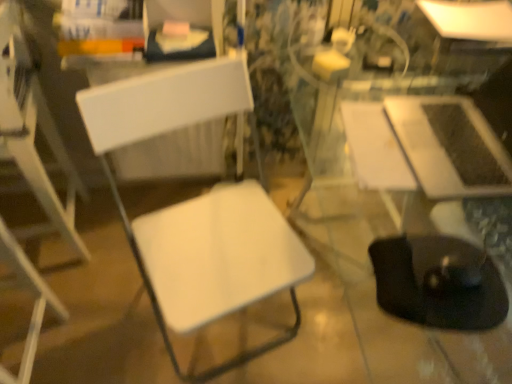
Question: Would you say white plastic chair at left, marked as the second chair in a right-to-left arrangement, is part of white glossy table at upper right, which is the 1th table in top-to-bottom order,'s contents?

Choices:
 (A) no
 (B) yes

Answer: (A)

Question: Can you confirm if white glossy table at upper right, the 2th table positioned from the bottom, is taller than white plastic chair at left, the 1th chair when ordered from left to right?

Choices:
 (A) yes
 (B) no

Answer: (B)

Question: Is white glossy table at upper right, acting as the 1th table starting from the back, with white plastic chair at left, the 1th chair when ordered from left to right?

Choices:
 (A) no
 (B) yes

Answer: (A)

Question: Does white glossy table at upper right, acting as the 1th table starting from the back, appear on the left side of white plastic chair at left, the 1th chair when ordered from left to right?

Choices:
 (A) yes
 (B) no

Answer: (B)

Question: Is white glossy table at upper right, which is the 1th table in top-to-bottom order, outside of white plastic chair at left, marked as the second chair in a right-to-left arrangement?

Choices:
 (A) no
 (B) yes

Answer: (B)

Question: Considering the relative sizes of white glossy table at upper right, the 2th table positioned from the bottom, and white plastic chair at left, the 1th chair when ordered from left to right, in the image provided, is white glossy table at upper right, the 2th table positioned from the bottom, bigger than white plastic chair at left, the 1th chair when ordered from left to right,?

Choices:
 (A) no
 (B) yes

Answer: (A)

Question: Is white plastic chair at left, marked as the second chair in a right-to-left arrangement, not near white glossy table at upper right, the 2th table positioned from the bottom?

Choices:
 (A) no
 (B) yes

Answer: (B)

Question: Does white plastic chair at left, the 1th chair when ordered from left to right, have a lesser height compared to white glossy table at upper right, the 2th table positioned from the bottom?

Choices:
 (A) yes
 (B) no

Answer: (B)

Question: Does white plastic chair at left, the 1th chair when ordered from left to right, have a greater height compared to white glossy table at upper right, which is the 1th table in top-to-bottom order?

Choices:
 (A) no
 (B) yes

Answer: (B)

Question: Does white plastic chair at left, marked as the second chair in a right-to-left arrangement, come in front of white glossy table at upper right, marked as the second table in a front-to-back arrangement?

Choices:
 (A) yes
 (B) no

Answer: (A)

Question: Could you tell me if white plastic chair at left, the 1th chair when ordered from left to right, is facing white glossy table at upper right, acting as the 1th table starting from the back?

Choices:
 (A) yes
 (B) no

Answer: (B)

Question: Is white plastic chair at left, the 1th chair when ordered from left to right, thinner than white glossy table at upper right, acting as the 1th table starting from the back?

Choices:
 (A) yes
 (B) no

Answer: (A)

Question: From a real-world perspective, is black rubber swivel chair at lower right over white matte chair at left, marked as the 1th chair in a right-to-left arrangement?

Choices:
 (A) no
 (B) yes

Answer: (B)